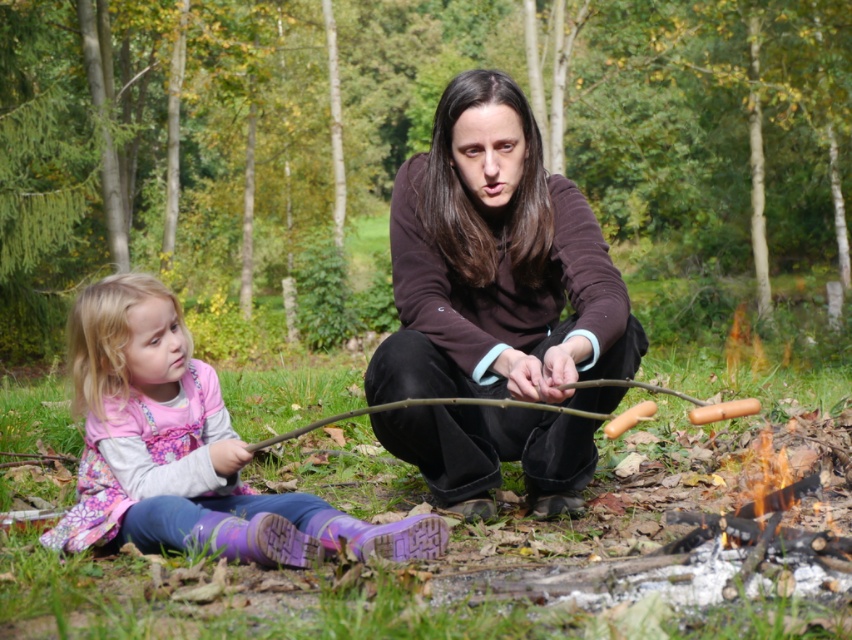
You are standing in the forest scene and want to place a small decorative rock between the two points labeled point (170, 392) and point (608, 413). Which point should the rock be closer to in order to be nearer to the viewer?

The rock should be placed closer to point (170, 392) because it is closer to the viewer than point (608, 413).

You are standing at the origin point of the image. There is a brown matte sweater at center located at point [498,266]. If you want to move towards the brown matte sweater at center, which direction should you move in terms of x and y coordinates?

To move towards the brown matte sweater at center located at point [498,266] from the origin, you should move in the positive x and positive y direction since both coordinates are greater than zero.